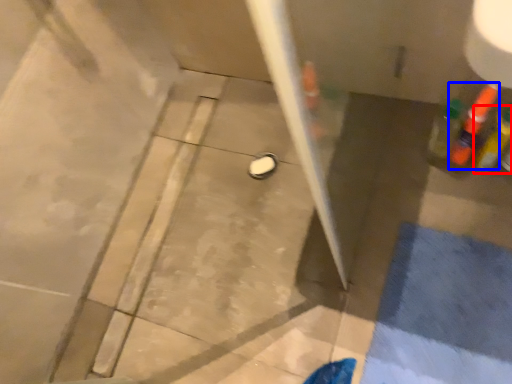
Question: Which of the following is the closest to the observer, bottle (highlighted by a red box) or bottle (highlighted by a blue box)?

Choices:
 (A) bottle
 (B) bottle

Answer: (A)